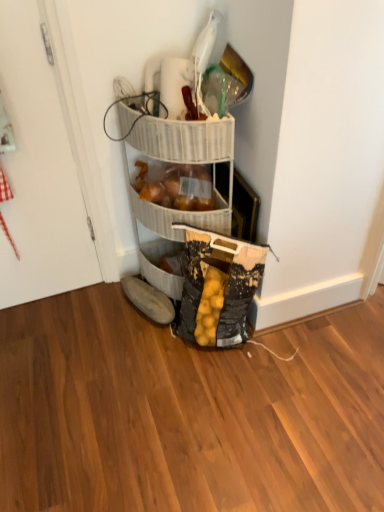
The height and width of the screenshot is (512, 384). I want to click on free space above brown suede shoe at lower center (from a real-world perspective), so click(140, 289).